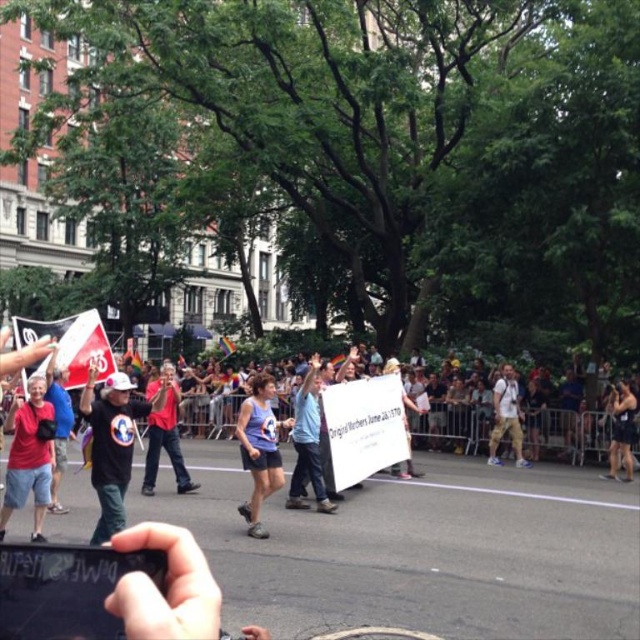
Question: Which object is farther from the camera taking this photo?

Choices:
 (A) matte red shorts at center
 (B) red cotton tank top at center
 (C) blue fabric shirt at center
 (D) white cotton shirt at center

Answer: (D)

Question: Is black matte shirt at center positioned in front of red cotton tank top at center?

Choices:
 (A) yes
 (B) no

Answer: (A)

Question: Does blue fabric tank top at center appear on the left side of blue fabric shirt at center?

Choices:
 (A) no
 (B) yes

Answer: (B)

Question: Which of the following is the farthest from the observer?

Choices:
 (A) (404, 429)
 (B) (508, 378)

Answer: (B)

Question: Which of the following is the closest to the observer?

Choices:
 (A) (8, 476)
 (B) (266, 406)
 (C) (88, 400)

Answer: (C)

Question: Does black matte shirt at center lie in front of matte red shorts at center?

Choices:
 (A) yes
 (B) no

Answer: (A)